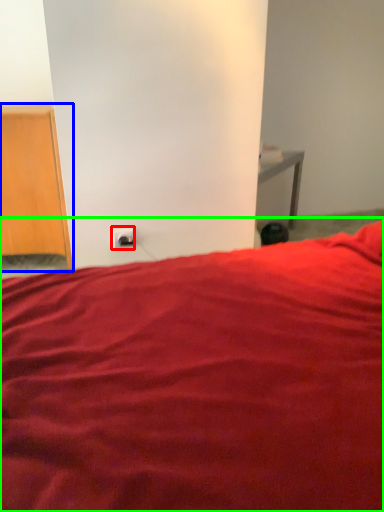
Question: Considering the real-world distances, which object is closest to electric outlet (highlighted by a red box)? furniture (highlighted by a blue box) or bed (highlighted by a green box).

Choices:
 (A) furniture
 (B) bed

Answer: (A)